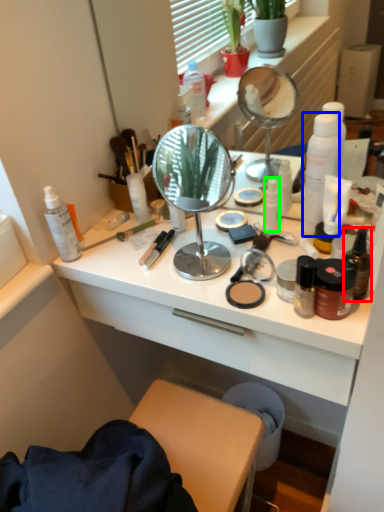
Question: Which object is the farthest from bottle (highlighted by a red box)? Choose among these: bottle (highlighted by a blue box) or toiletry (highlighted by a green box).

Choices:
 (A) bottle
 (B) toiletry

Answer: (B)